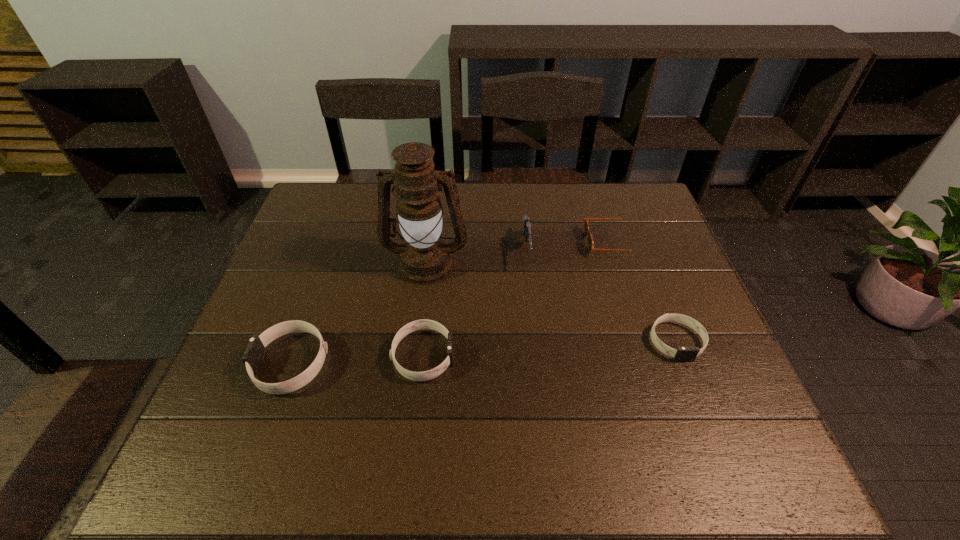
To achieve uniform spacing by inserting another wristband among them, please point to a free space for this new wristband. Please provide its 2D coordinates. Your answer should be formatted as a tuple, i.e. [(x, y)], where the tuple contains the x and y coordinates of a point satisfying the conditions above.

[(551, 348)]